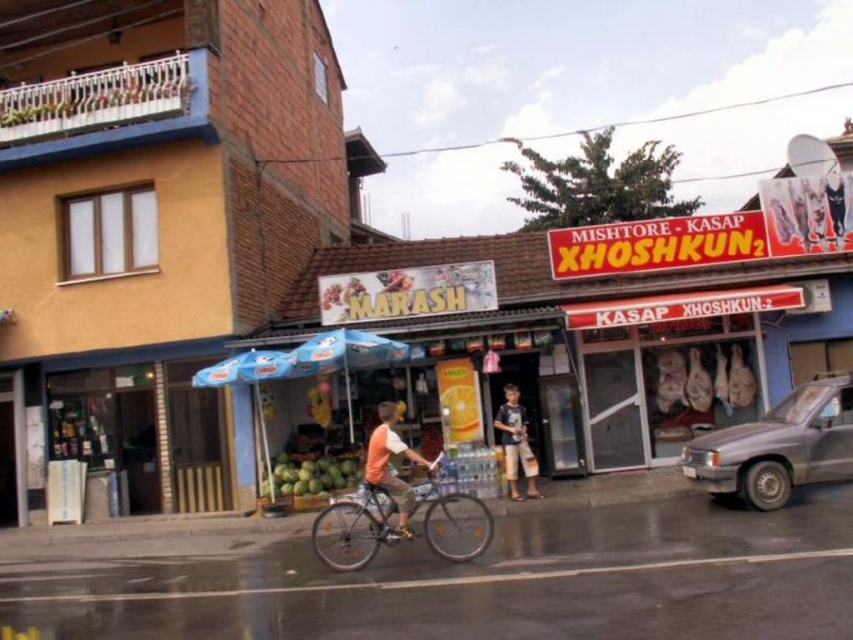
You are a delivery person who needs to park your silver metallic bicycle at center near the orange cotton shirt at center. Can both items fit side by side in the space available?

The silver metallic bicycle at center might be wider than orange cotton shirt at center, so there is a possibility that they cannot fit side by side without overlapping.

You are a customer standing in front of the shop and see the green matte coconuts at center and the dark blue cotton shirt at center. Which object is taller?

The dark blue cotton shirt at center is taller than the green matte coconuts at center.

You are a delivery person standing in front of the shop named Kasap Xhoshkun. You need to place a package on the silver metallic bicycle at center and then deliver a letter to the dark blue cotton shirt at center. Which item should you interact with first based on their positions?

The silver metallic bicycle at center is closer to the viewer than the dark blue cotton shirt at center, so you should interact with the silver metallic bicycle at center first before delivering the letter to the dark blue cotton shirt at center.